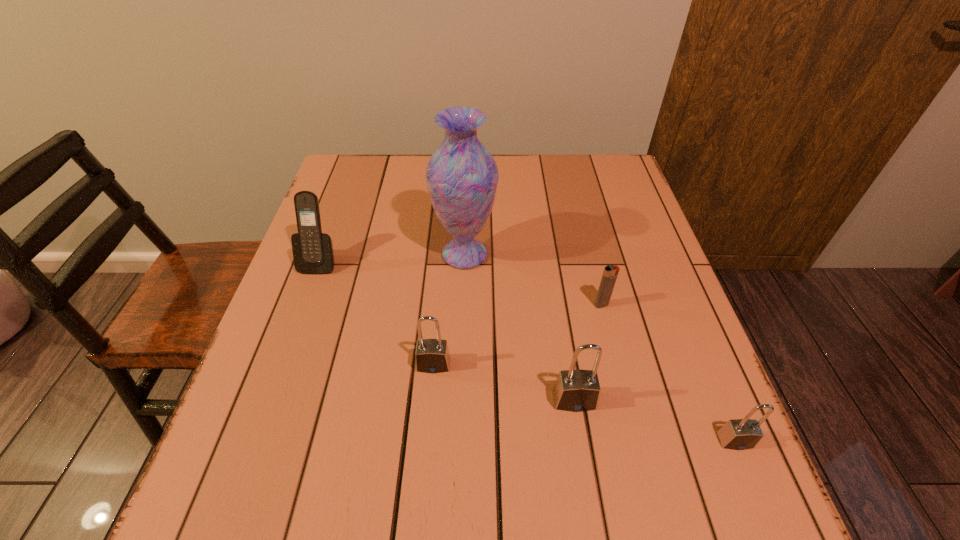
This screenshot has height=540, width=960. I want to click on the third shortest object, so click(432, 356).

Where is `the farthest padlock`? This screenshot has width=960, height=540. the farthest padlock is located at coordinates (432, 356).

Find the location of a particular element. the third object from right to left is located at coordinates (x=578, y=390).

The height and width of the screenshot is (540, 960). Identify the location of the second padlock from left to right. (578, 390).

This screenshot has width=960, height=540. In order to click on the nearest object in this screenshot , I will do `click(739, 434)`.

Where is `the nearest padlock`? The height and width of the screenshot is (540, 960). the nearest padlock is located at coordinates (739, 434).

Identify the location of the tallest object. tap(462, 176).

Identify the location of igniter. This screenshot has height=540, width=960. (610, 273).

Identify the location of the third farthest object. The height and width of the screenshot is (540, 960). (610, 273).

This screenshot has height=540, width=960. I want to click on cellular telephone, so click(313, 253).